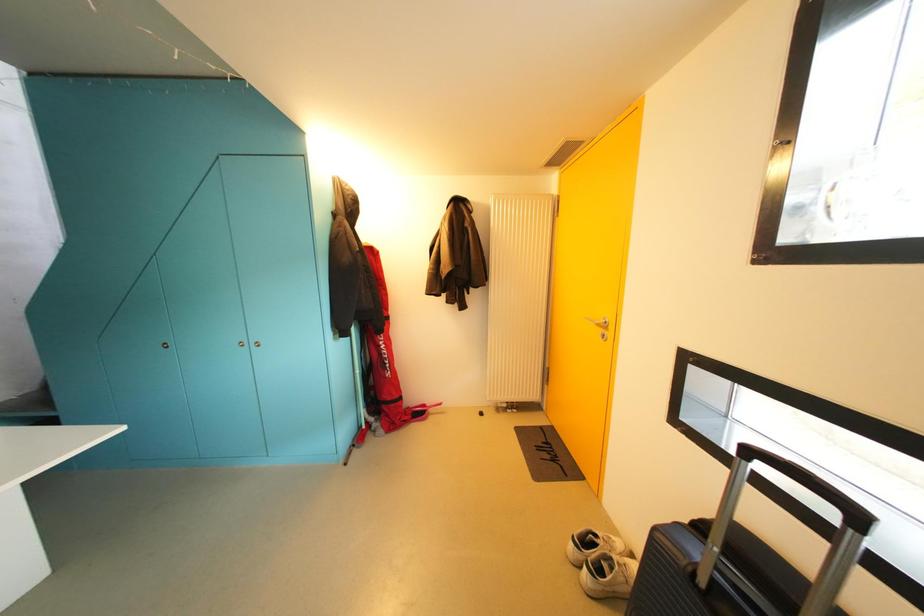
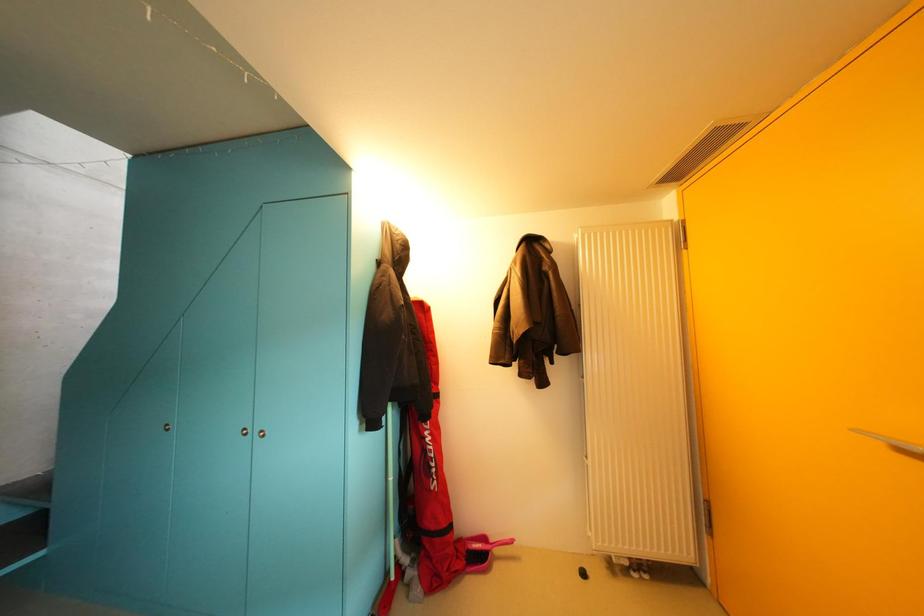
Question: How did the camera likely rotate?

Choices:
 (A) Left
 (B) Right
 (C) Up
 (D) Down

Answer: (C)